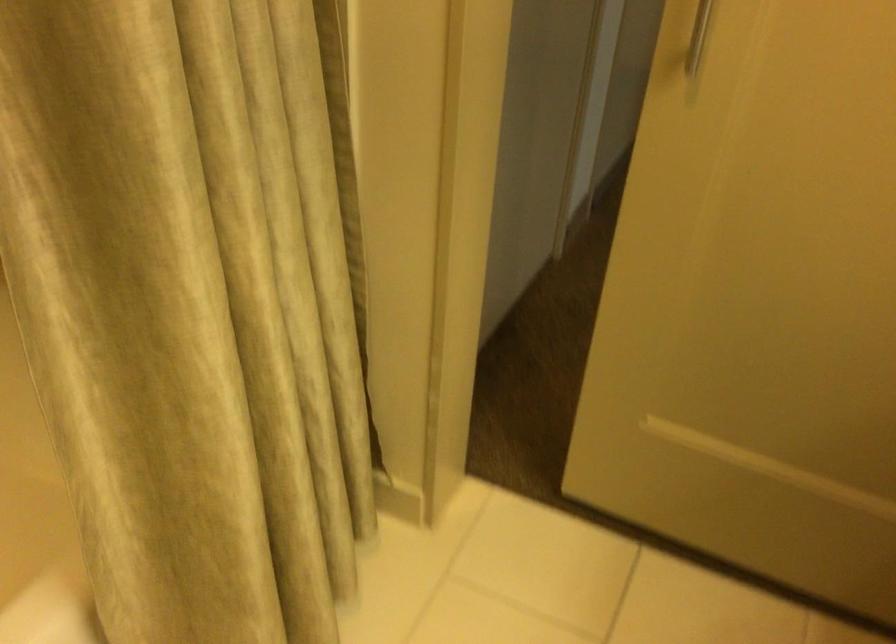
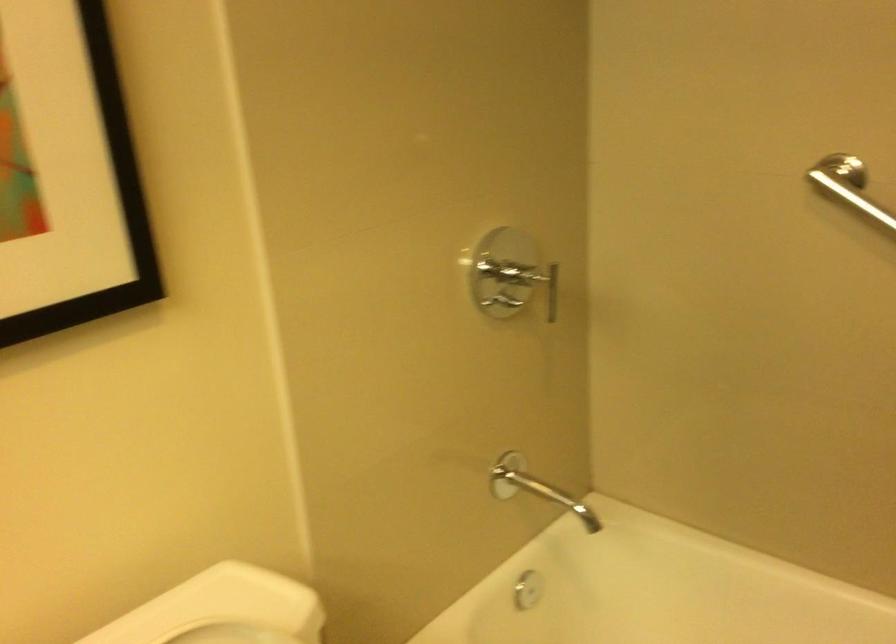
The first image is from the beginning of the video and the second image is from the end. How did the camera likely rotate when shooting the video?

The camera's rotation is toward left-down.